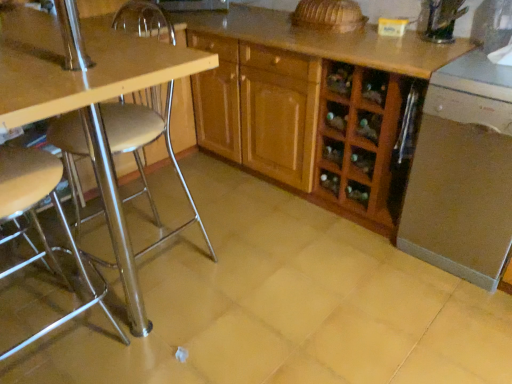
I want to click on free space in front of metallic silver stool at left, so click(132, 362).